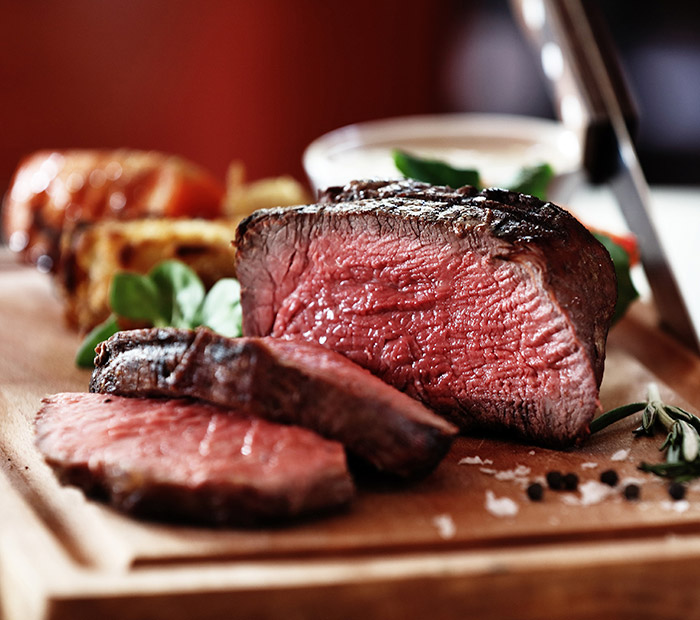
Find the location of a particular element. The width and height of the screenshot is (700, 620). knife handle is located at coordinates (554, 43).